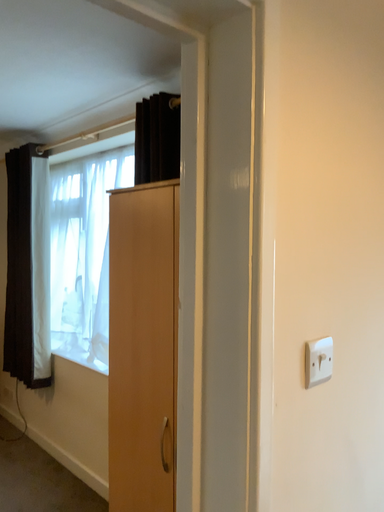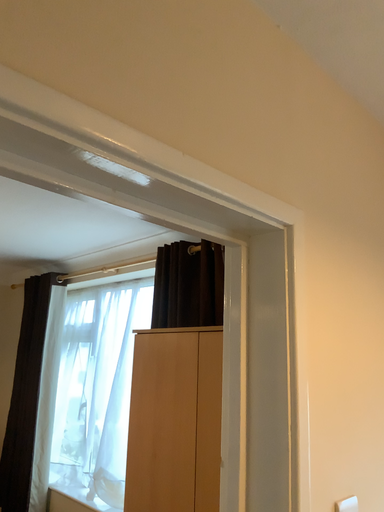
Question: How did the camera likely rotate when shooting the video?

Choices:
 (A) rotated upward
 (B) rotated downward

Answer: (A)